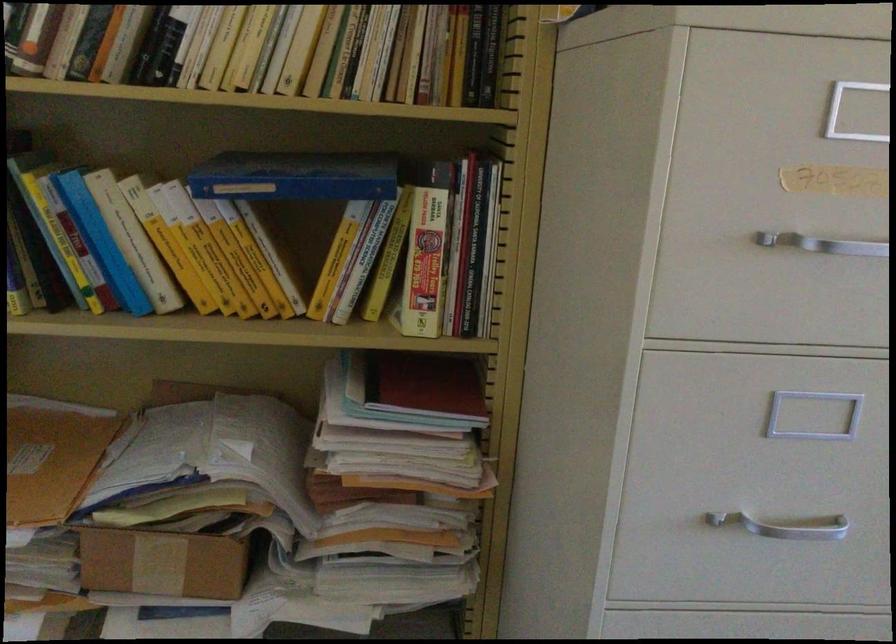
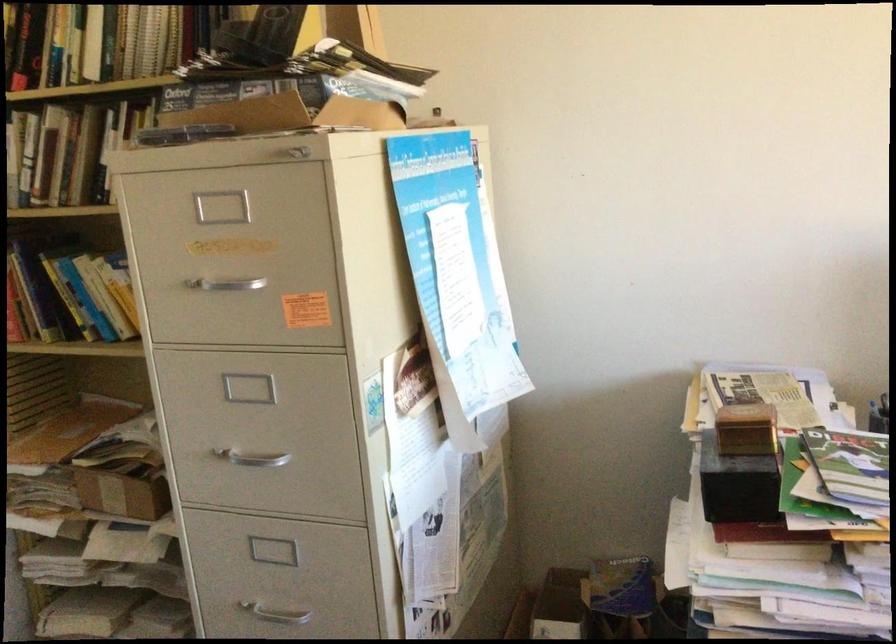
Find the pixel in the second image that matches [212,554] in the first image.

(123, 488)